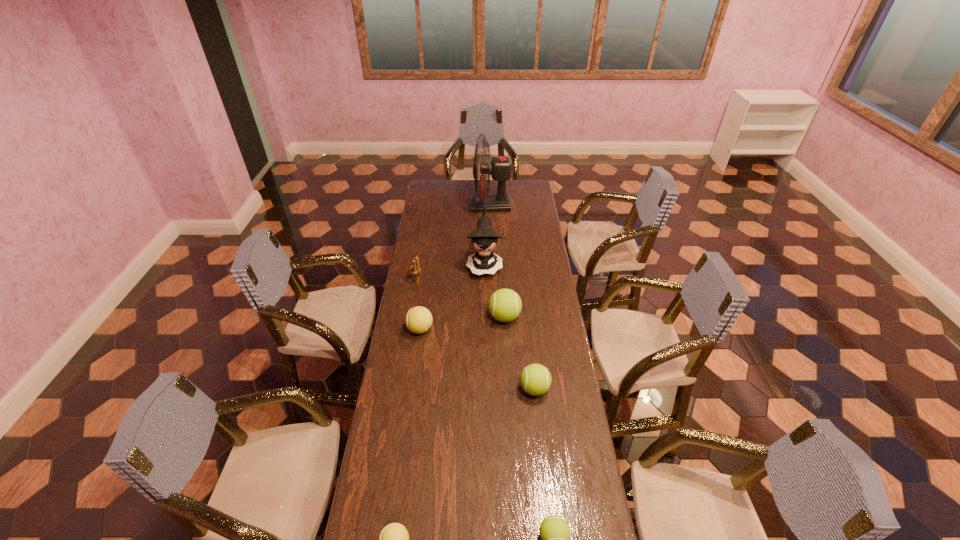
You are a GUI agent. You are given a task and a screenshot of the screen. Output one action in this format:
    pyautogui.click(x=<x>, y=<y>)
    Task: Click on the fourth closest tennis ball to the farther yellow tennis ball
    
    Given the screenshot: What is the action you would take?
    pyautogui.click(x=554, y=531)

The height and width of the screenshot is (540, 960). I want to click on the closest green tennis ball to the candle holder, so click(x=505, y=305).

Identify which green tennis ball is the second closest to the doll. Please provide its 2D coordinates. Your answer should be formatted as a tuple, i.e. [(x, y)], where the tuple contains the x and y coordinates of a point satisfying the conditions above.

[(535, 379)]

Identify the location of vacant point that satisfies the following two spatial constraints: 1. at the face of the third farthest tennis ball; 2. on the left side of the second tallest object. Image resolution: width=960 pixels, height=540 pixels. (486, 389).

You are a GUI agent. You are given a task and a screenshot of the screen. Output one action in this format:
    pyautogui.click(x=<x>, y=<y>)
    Task: Click on the vacant area in the image that satisfies the following two spatial constraints: 1. on the front-facing side of the farthest object; 2. at the face of the second tallest object
    The image size is (960, 540).
    Given the screenshot: What is the action you would take?
    pyautogui.click(x=492, y=265)

Identify the location of free point that satisfies the following two spatial constraints: 1. at the face of the sixth farthest object; 2. on the left side of the second tallest object. (486, 389).